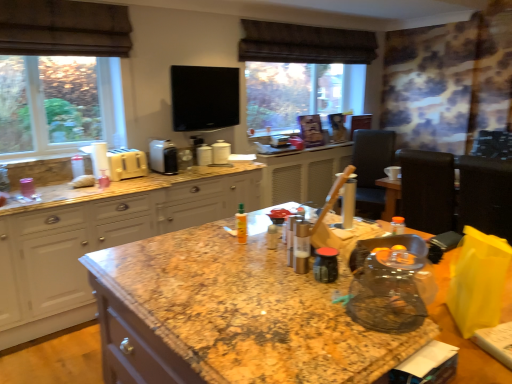
At what (x,y) coordinates should I click in order to perform the action: click on space that is in front of white plastic toaster at center, which is the 3th appliance from right to left. Please return your answer as a coordinate pair (x, y). This screenshot has width=512, height=384. Looking at the image, I should click on (164, 177).